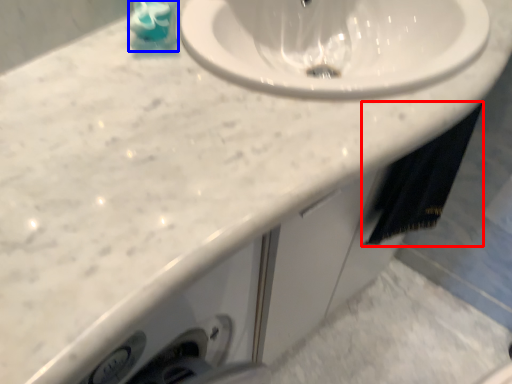
Question: Which point is closer to the camera, bath towel (highlighted by a red box) or liquid (highlighted by a blue box)?

Choices:
 (A) bath towel
 (B) liquid

Answer: (B)